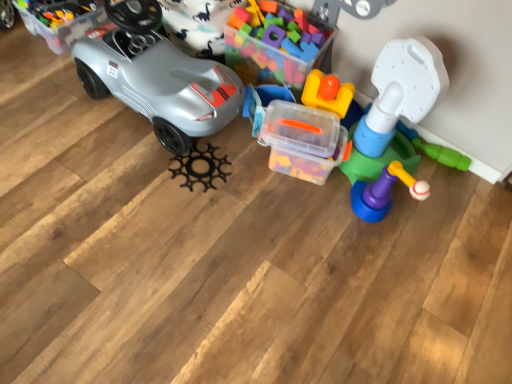
Question: Considering the relative positions of translucent plastic tower at right, placed as the 4th toy when sorted from left to right, and black matte gear at center, which is counted as the first toy, starting from the left, in the image provided, is translucent plastic tower at right, placed as the 4th toy when sorted from left to right, to the left or to the right of black matte gear at center, which is counted as the first toy, starting from the left,?

Choices:
 (A) left
 (B) right

Answer: (B)

Question: From a real-world perspective, relative to black matte gear at center, positioned as the fourth toy in right-to-left order, is translucent plastic tower at right, the first toy from the right, vertically above or below?

Choices:
 (A) above
 (B) below

Answer: (A)

Question: Which is farther from the translucent plastic container at center, the third toy viewed from the right?

Choices:
 (A) matte gray car at left
 (B) black matte gear at center, positioned as the fourth toy in right-to-left order
 (C) translucent plastic tower at right, the first toy from the right
 (D) translucent plastic blocks at center, acting as the third toy starting from the left
 (E) clear plastic storage box at upper left

Answer: (E)

Question: Which is farther from the clear plastic storage box at upper left?

Choices:
 (A) translucent plastic tower at right, placed as the 4th toy when sorted from left to right
 (B) matte gray car at left
 (C) translucent plastic blocks at center, which is counted as the 2th toy, starting from the right
 (D) black matte gear at center, positioned as the fourth toy in right-to-left order
 (E) translucent plastic container at center, the second toy in the left-to-right sequence

Answer: (A)